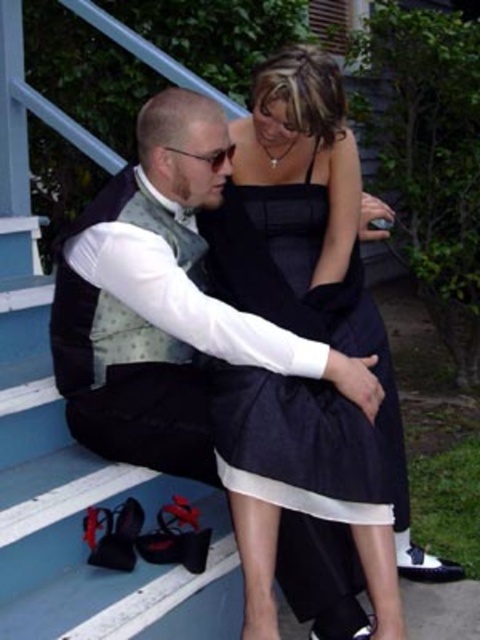
Can you confirm if white leather shoe at lower right is positioned to the left of black leather shoe at lower right?

In fact, white leather shoe at lower right is to the right of black leather shoe at lower right.

Does point (396, 550) come behind point (354, 634)?

That is True.

I want to click on white leather shoe at lower right, so click(425, 564).

Between satin black dress at center and white leather shoe at lower right, which one has more height?

Standing taller between the two is satin black dress at center.

Who is positioned more to the left, satin black dress at center or white leather shoe at lower right?

satin black dress at center

Who is more distant from viewer, (243, 528) or (404, 550)?

Positioned behind is point (404, 550).

Image resolution: width=480 pixels, height=640 pixels. I want to click on satin black dress at center, so click(x=304, y=336).

Who is more distant from viewer, (156,452) or (432,573)?

Point (432,573)

Is point (158, 253) farther from viewer compared to point (428, 563)?

No, (158, 253) is in front of (428, 563).

Who is more forward, (200, 298) or (436, 572)?

Positioned in front is point (200, 298).

The width and height of the screenshot is (480, 640). What are the coordinates of `black satin vest at center` in the screenshot? It's located at (164, 305).